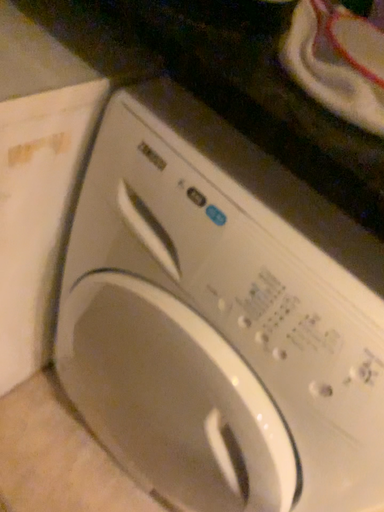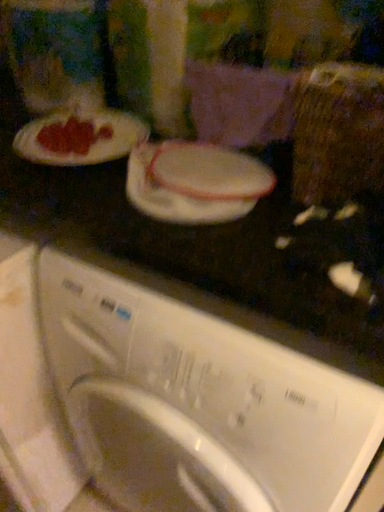
Question: Which way did the camera rotate in the video?

Choices:
 (A) rotated right
 (B) rotated left

Answer: (B)